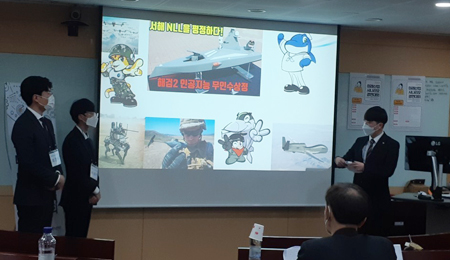
You are a GUI agent. You are given a task and a screenshot of the screen. Output one action in this format:
    pyautogui.click(x=<x>, y=<y>)
    Task: Click on the speakers
    The height and width of the screenshot is (260, 450).
    Given the screenshot: What is the action you would take?
    pyautogui.click(x=362, y=167), pyautogui.click(x=81, y=148), pyautogui.click(x=30, y=153)